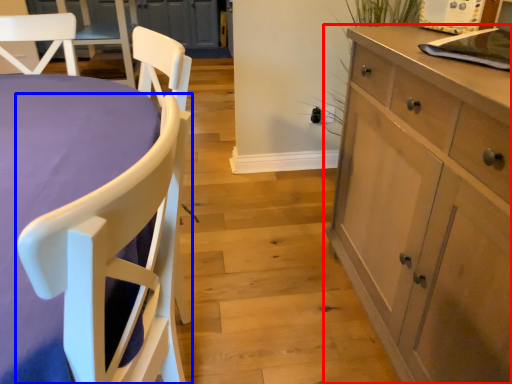
Question: Which object appears closest to the camera in this image, cabinetry (highlighted by a red box) or chair (highlighted by a blue box)?

Choices:
 (A) cabinetry
 (B) chair

Answer: (B)